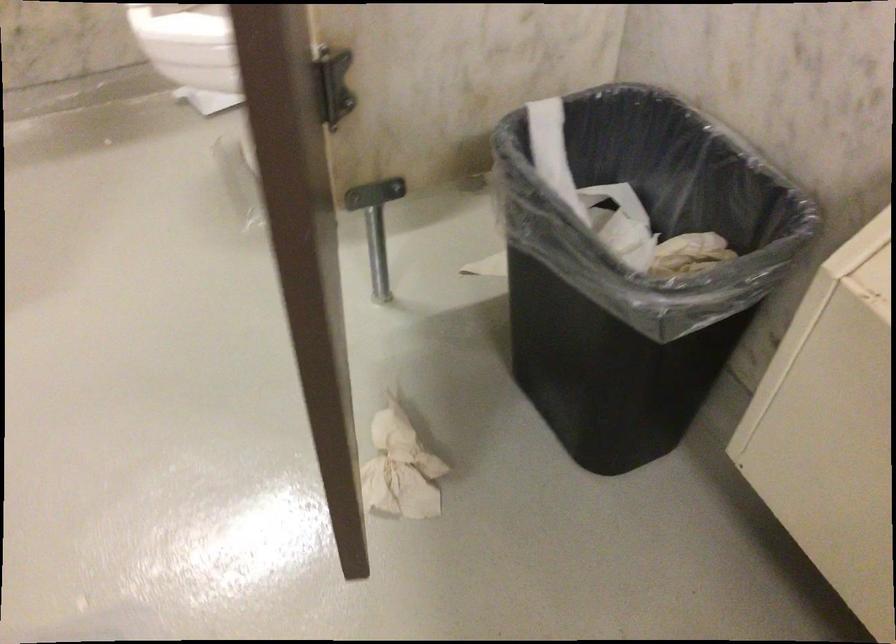
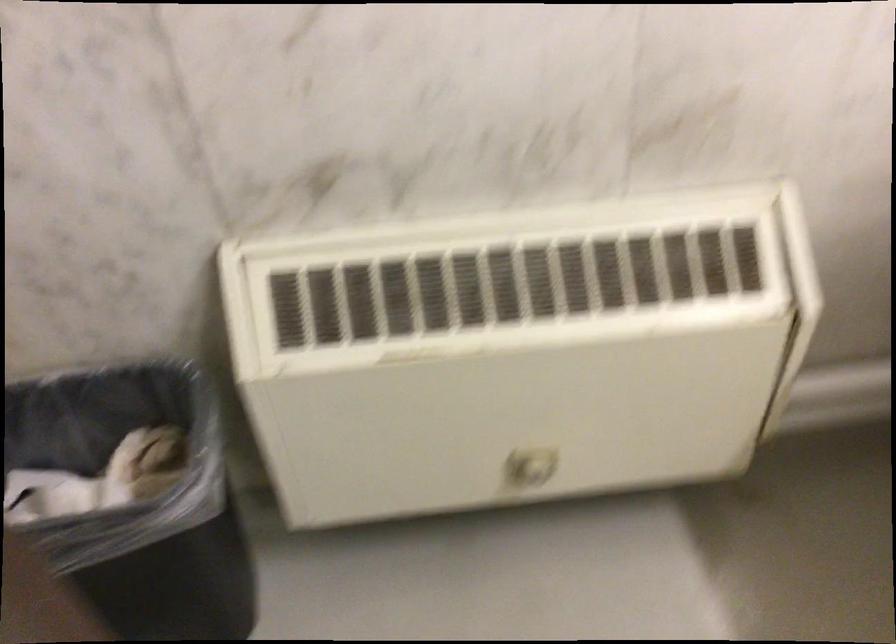
Based on the continuous images, in which direction is the camera rotating?

The rotation direction of the camera is right-down.